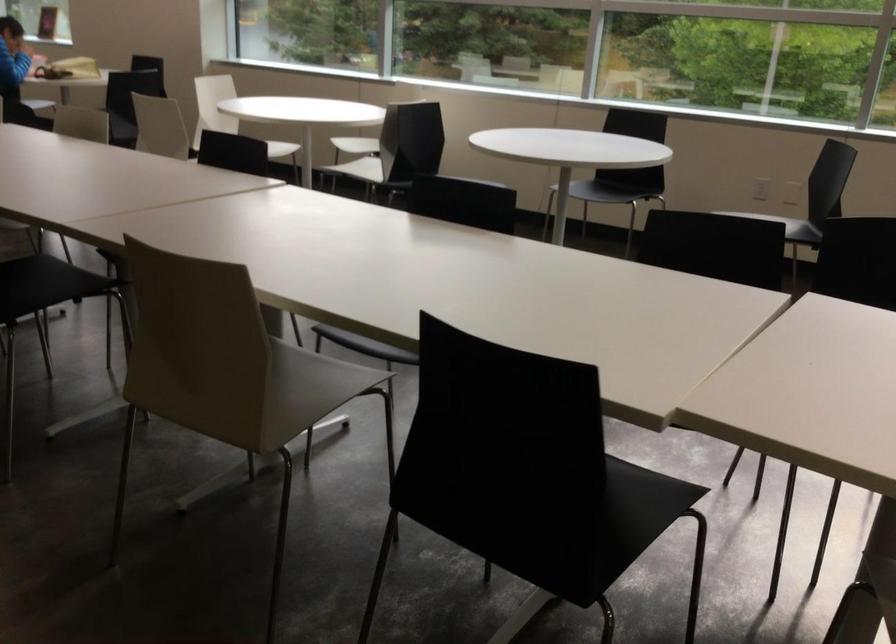
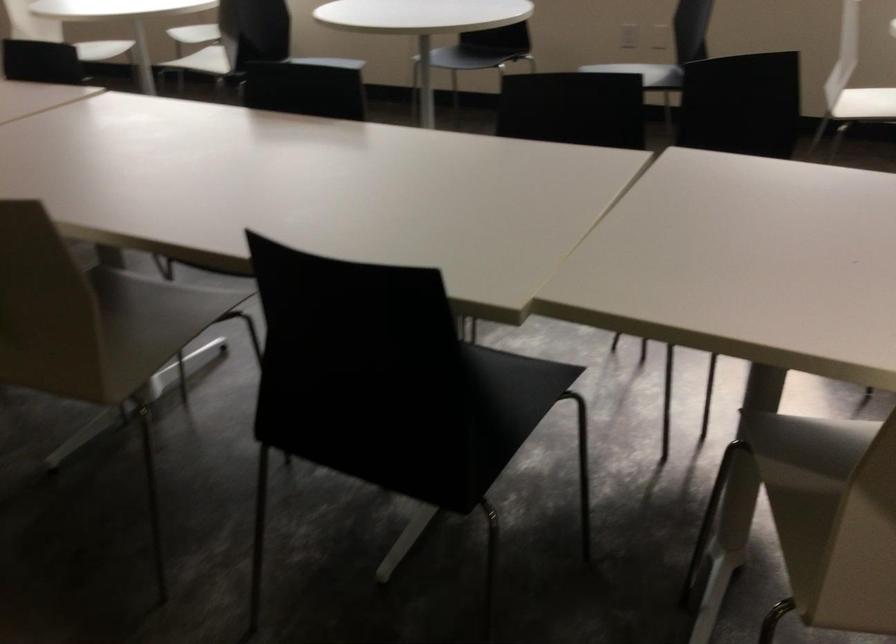
Question: The first image is from the beginning of the video and the second image is from the end. How did the camera likely rotate when shooting the video?

Choices:
 (A) Left
 (B) Right
 (C) Up
 (D) Down

Answer: (D)